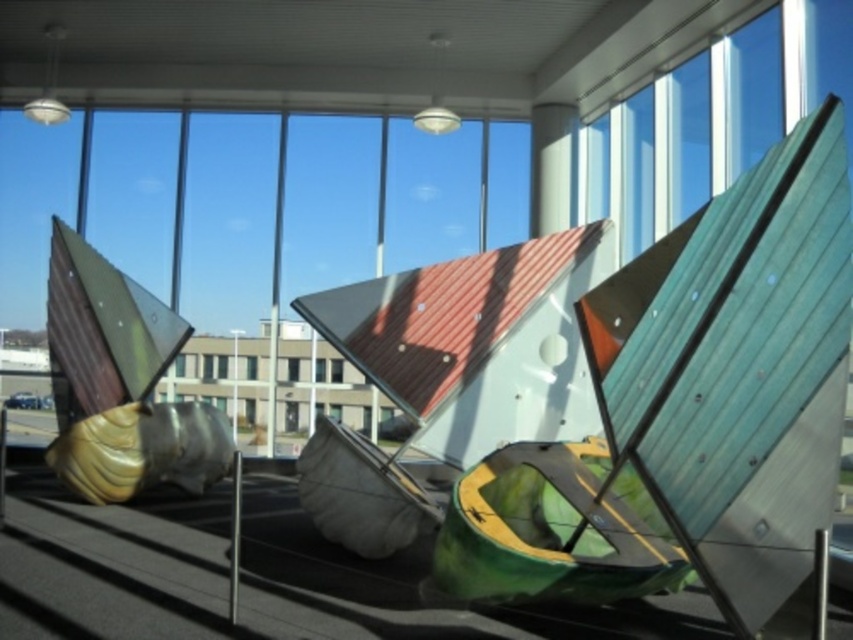
Question: Which object appears closest to the camera in this image?

Choices:
 (A) transparent glass window at center
 (B) gold metallic sculpture at left

Answer: (B)

Question: Does gold metallic sculpture at left appear over transparent glass window at center?

Choices:
 (A) yes
 (B) no

Answer: (A)

Question: Considering the relative positions of gold metallic sculpture at left and transparent glass window at center in the image provided, where is gold metallic sculpture at left located with respect to transparent glass window at center?

Choices:
 (A) above
 (B) below

Answer: (A)

Question: Can you confirm if gold metallic sculpture at left is smaller than transparent glass window at center?

Choices:
 (A) yes
 (B) no

Answer: (B)

Question: Among these objects, which one is nearest to the camera?

Choices:
 (A) gold metallic sculpture at left
 (B) transparent glass window at center

Answer: (A)

Question: Which object appears farthest from the camera in this image?

Choices:
 (A) gold metallic sculpture at left
 (B) transparent glass window at center

Answer: (B)